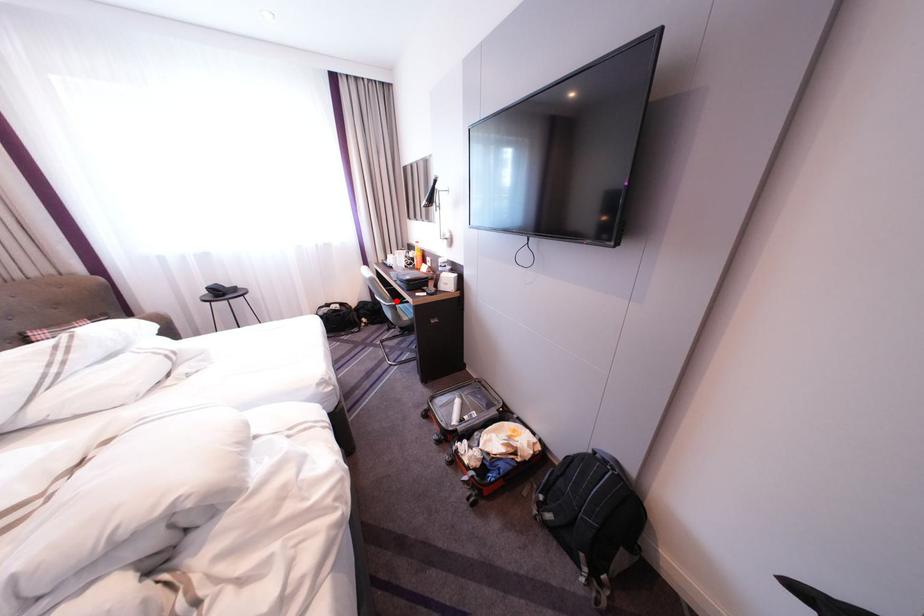
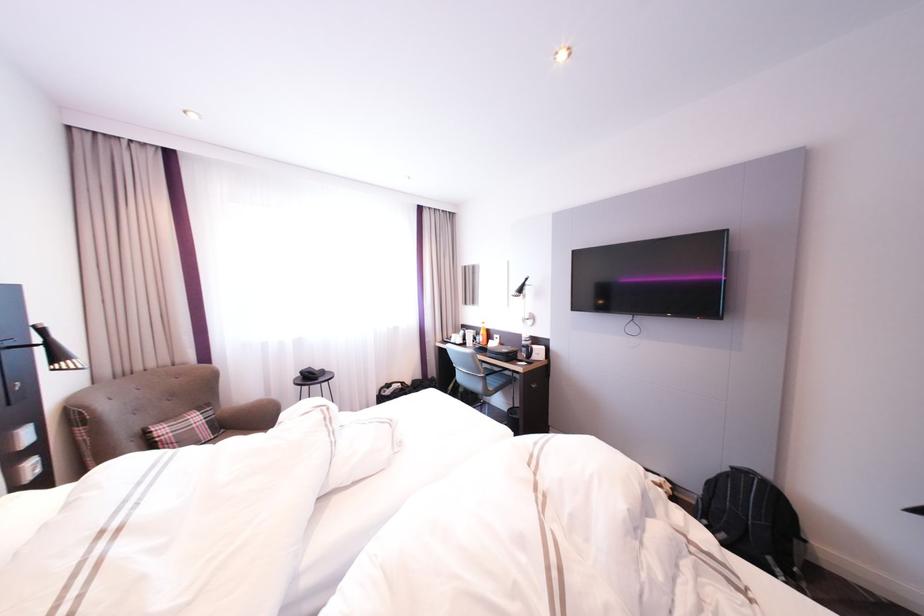
Question: I am providing you with two images of the same scene from different viewpoints. A red point is marked on the first image. At the location where the point appears in image 1, is it still visible in image 2?

Choices:
 (A) Yes
 (B) No

Answer: (A)